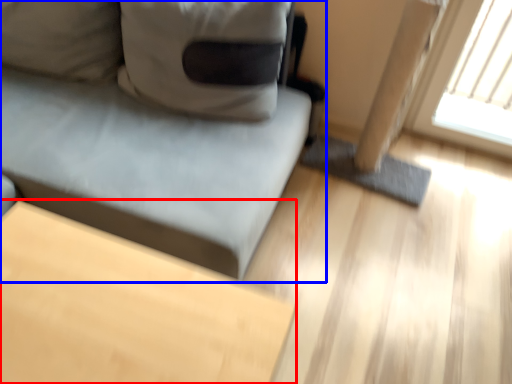
Question: Which object is closer to the camera taking this photo, table (highlighted by a red box) or studio couch (highlighted by a blue box)?

Choices:
 (A) table
 (B) studio couch

Answer: (A)